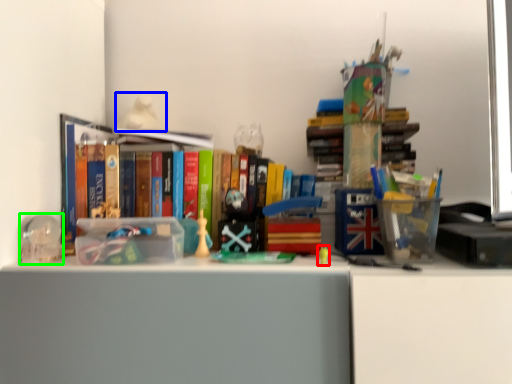
Question: Considering the real-world distances, which object is closest to toy (highlighted by a red box)? toy (highlighted by a blue box) or stationery (highlighted by a green box).

Choices:
 (A) toy
 (B) stationery

Answer: (B)